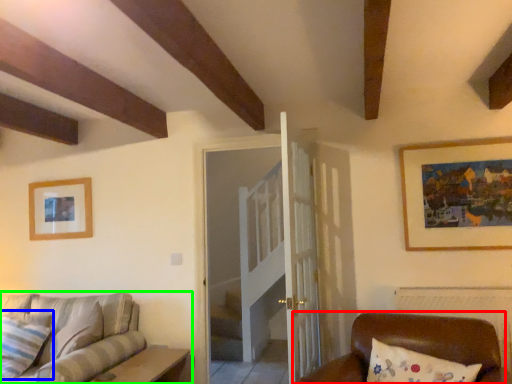
Question: Which is nearer to the furniture (highlighted by a red box)? pillow (highlighted by a blue box) or studio couch (highlighted by a green box).

Choices:
 (A) pillow
 (B) studio couch

Answer: (B)